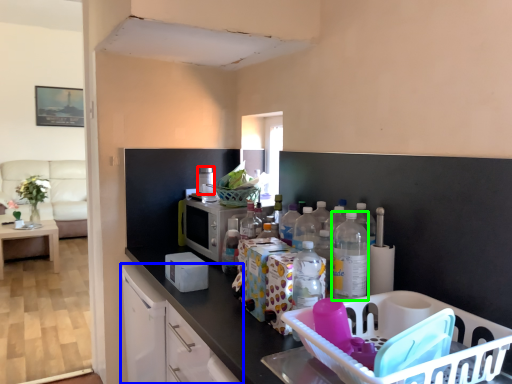
Question: Considering the real-world distances, which object is farthest from appliance (highlighted by a red box)? cabinetry (highlighted by a blue box) or bottle (highlighted by a green box)?

Choices:
 (A) cabinetry
 (B) bottle

Answer: (B)